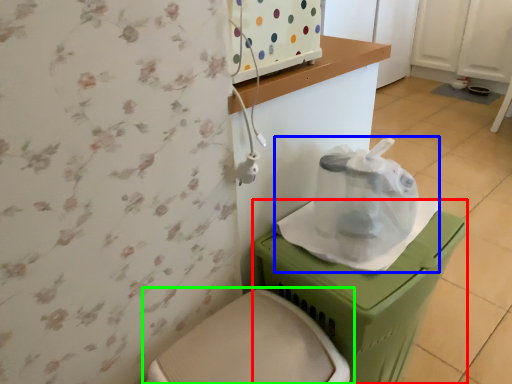
Question: Based on their relative distances, which object is farther from potty (highlighted by a red box)? Choose from paper bag (highlighted by a blue box) and toilet (highlighted by a green box).

Choices:
 (A) paper bag
 (B) toilet

Answer: (B)